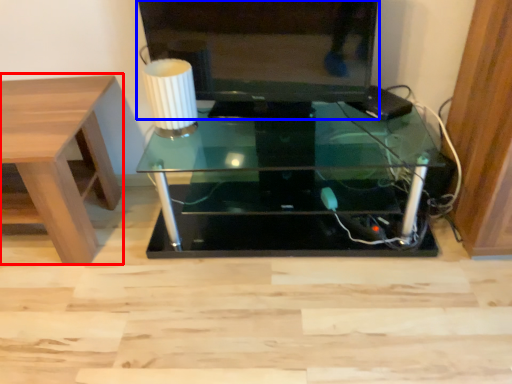
Question: Which object is further to the camera taking this photo, table (highlighted by a red box) or television (highlighted by a blue box)?

Choices:
 (A) table
 (B) television

Answer: (B)